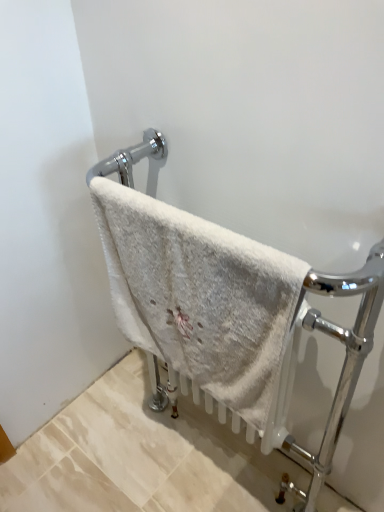
Question: Should I look upward or downward to see white fluffy towel at center?

Choices:
 (A) up
 (B) down

Answer: (B)